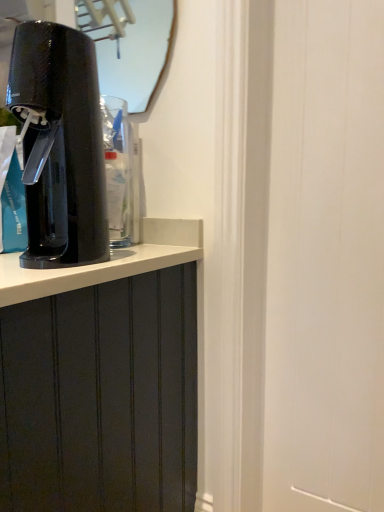
Question: Considering the relative positions of black glossy soda maker at left and matte glass mirror at upper center in the image provided, is black glossy soda maker at left to the left or to the right of matte glass mirror at upper center?

Choices:
 (A) left
 (B) right

Answer: (A)

Question: From their relative heights in the image, would you say black glossy soda maker at left is taller or shorter than matte glass mirror at upper center?

Choices:
 (A) short
 (B) tall

Answer: (B)

Question: Based on their relative distances, which object is farther from the matte glass mirror at upper center?

Choices:
 (A) transparent plastic water cooler at left
 (B) black glossy soda maker at left

Answer: (B)

Question: Which object is the farthest from the transparent plastic water cooler at left?

Choices:
 (A) black glossy soda maker at left
 (B) matte glass mirror at upper center

Answer: (B)